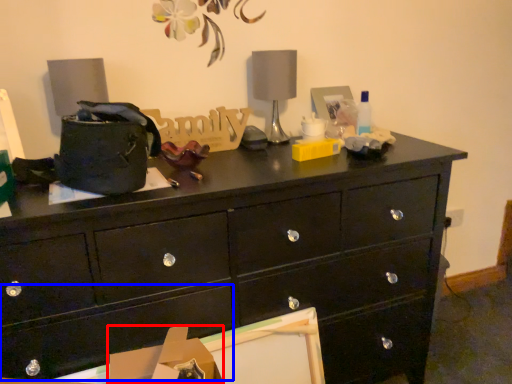
Question: Which object appears farthest to the camera in this image, cardboard box (highlighted by a red box) or drawer (highlighted by a blue box)?

Choices:
 (A) cardboard box
 (B) drawer

Answer: (A)